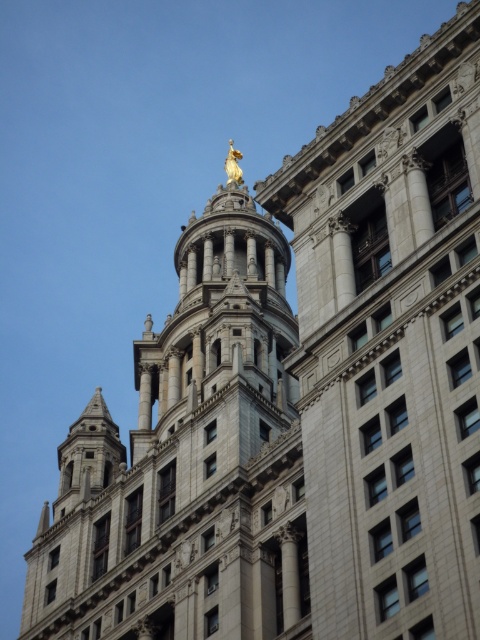
Is gray stone tower at center wider than gold polished statue at upper center?

No.

Find the location of `gray stone tower at center`. gray stone tower at center is located at coordinates (392, 346).